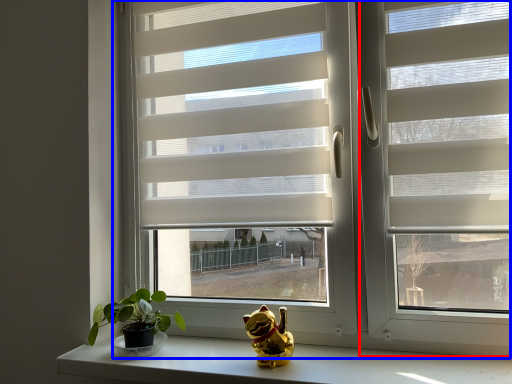
Question: Which point is closer to the camera, screen door (highlighted by a red box) or window (highlighted by a blue box)?

Choices:
 (A) screen door
 (B) window

Answer: (A)